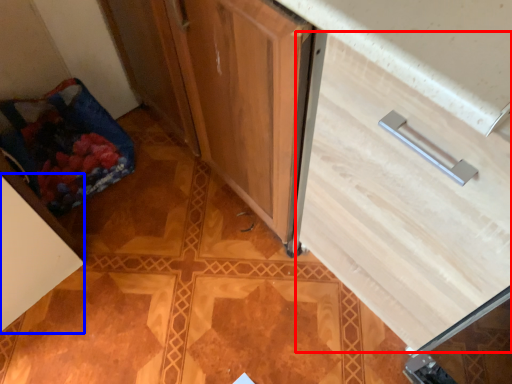
Question: Among these objects, which one is nearest to the camera, drawer (highlighted by a red box) or cabinetry (highlighted by a blue box)?

Choices:
 (A) drawer
 (B) cabinetry

Answer: (A)